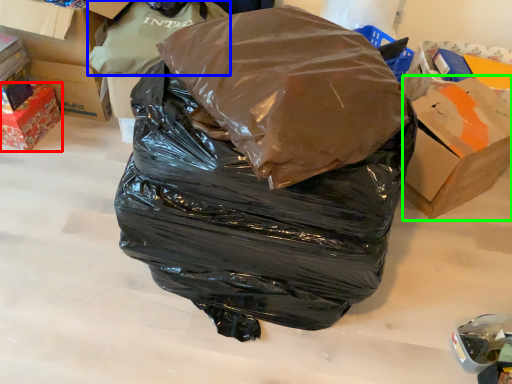
Question: Estimate the real-world distances between objects in this image. Which object is farther from box (highlighted by a red box), plastic bag (highlighted by a blue box) or cardboard box (highlighted by a green box)?

Choices:
 (A) plastic bag
 (B) cardboard box

Answer: (B)